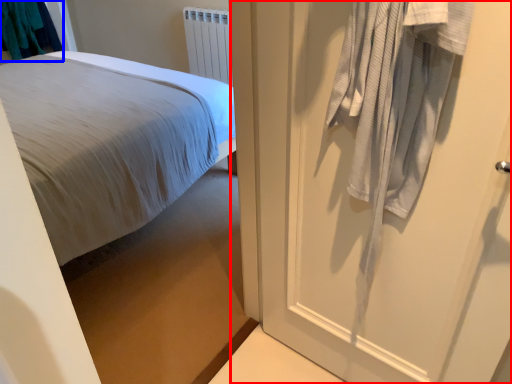
Question: Which point is closer to the camera, door (highlighted by a red box) or laundry (highlighted by a blue box)?

Choices:
 (A) door
 (B) laundry

Answer: (A)